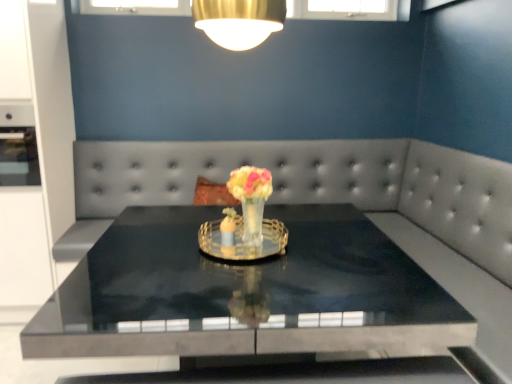
What are the coordinates of `vacant point above black polished table at center (from a real-world perspective)` in the screenshot? It's located at (314, 258).